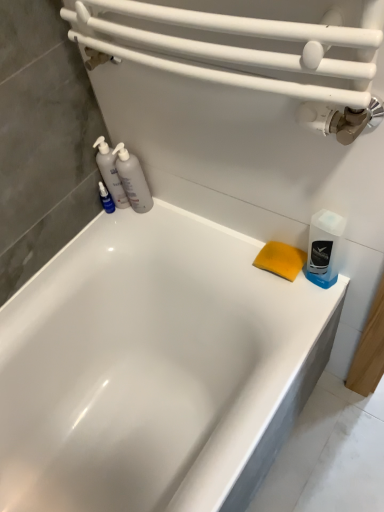
I want to click on vacant space situated on the left part of translucent plastic bottles at left, the second cleaning product in the right-to-left sequence, so click(x=105, y=229).